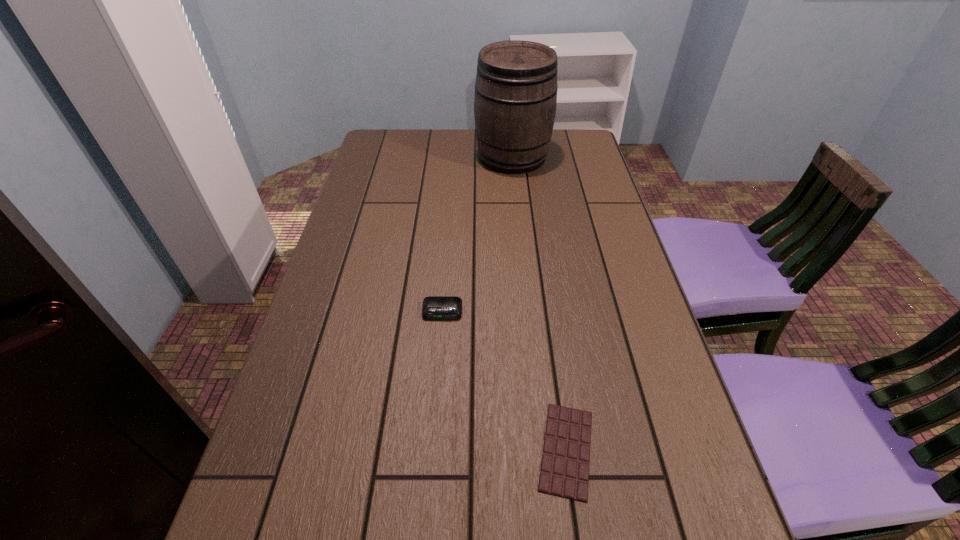
You are a GUI agent. You are given a task and a screenshot of the screen. Output one action in this format:
    pyautogui.click(x=<x>, y=<y>)
    Task: Click on the blank region between the farthest object and the leftmost object
    This screenshot has width=960, height=540.
    Given the screenshot: What is the action you would take?
    (x=477, y=234)

At what (x,y) coordinates should I click in order to perform the action: click on vacant space that is in between the wine bucket and the second shortest object. Please return your answer as a coordinate pair (x, y). Looking at the image, I should click on (477, 234).

Locate an element on the screen. vacant area between the shortest object and the wine bucket is located at coordinates (540, 303).

This screenshot has width=960, height=540. Find the location of `unoccupied area between the second shortest object and the nearest object`. unoccupied area between the second shortest object and the nearest object is located at coordinates (504, 381).

Find the location of a particular element. Image resolution: width=960 pixels, height=540 pixels. unoccupied area between the farthest object and the second shortest object is located at coordinates tap(477, 234).

Where is `free spot between the alarm clock and the shortest object`? free spot between the alarm clock and the shortest object is located at coordinates (504, 381).

Locate an element on the screen. Image resolution: width=960 pixels, height=540 pixels. vacant space in between the farthest object and the alarm clock is located at coordinates (477, 234).

Select which object appears as the closest to the shortest object. Please provide its 2D coordinates. Your answer should be formatted as a tuple, i.e. [(x, y)], where the tuple contains the x and y coordinates of a point satisfying the conditions above.

[(434, 307)]

Locate which object is the second closest to the farthest object. Please provide its 2D coordinates. Your answer should be formatted as a tuple, i.e. [(x, y)], where the tuple contains the x and y coordinates of a point satisfying the conditions above.

[(564, 472)]

This screenshot has height=540, width=960. In order to click on free space that satisfies the following two spatial constraints: 1. on the display of the second shortest object; 2. on the left side of the shortest object in this screenshot , I will do `click(432, 450)`.